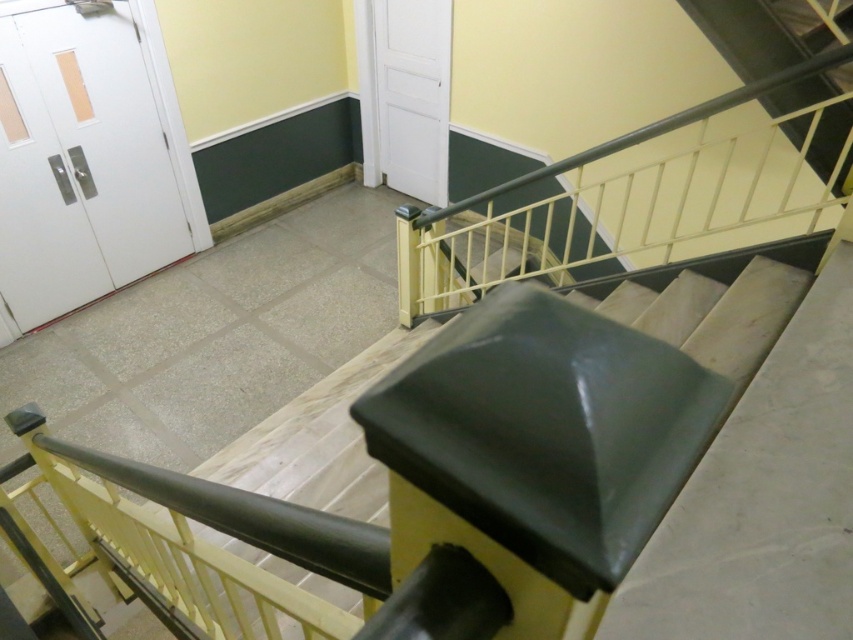
Does white matte door at left have a lesser height compared to white matte door at upper center?

No, white matte door at left is not shorter than white matte door at upper center.

Who is positioned more to the left, white matte door at left or white matte door at upper center?

Positioned to the left is white matte door at left.

Measure the distance between point [55,307] and camera.

A distance of 4.15 meters exists between point [55,307] and camera.

The width and height of the screenshot is (853, 640). I want to click on white matte door at left, so click(x=79, y=163).